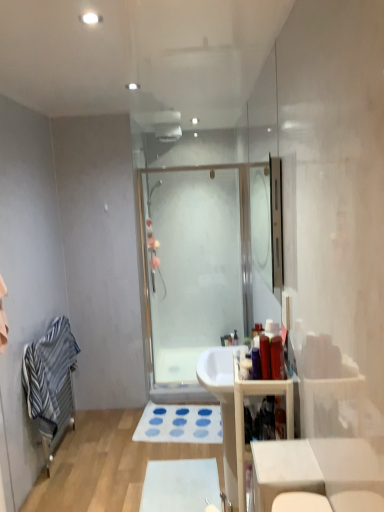
Looking at this image, in order to face wooden cabinet at right, should I rotate leftwards or rightwards?

Turn right by 8.978 degrees to look at wooden cabinet at right.

Locate an element on the screen. The width and height of the screenshot is (384, 512). matte plastic container at right, marked as the 1th toiletry in a right-to-left arrangement is located at coordinates (277, 358).

What is the approximate height of translucent plastic bottle at right, which ranks as the 1th toiletry in left-to-right order?

translucent plastic bottle at right, which ranks as the 1th toiletry in left-to-right order, is 6.79 inches tall.

Where is `blue fabric bath mat at lower center, arranged as the second bath mat when viewed from the front`? blue fabric bath mat at lower center, arranged as the second bath mat when viewed from the front is located at coordinates (180, 424).

This screenshot has width=384, height=512. Find the location of `white glossy sink at center`. white glossy sink at center is located at coordinates (223, 405).

Is wooden cabinet at right positioned with its back to matte plastic bottle at right, the 2th toiletry viewed from the right?

That's not correct — wooden cabinet at right is not looking away from matte plastic bottle at right, the 2th toiletry viewed from the right.

Considering the positions of objects wooden cabinet at right and matte plastic bottle at right, placed as the second toiletry when sorted from left to right, in the image provided, who is more to the right, wooden cabinet at right or matte plastic bottle at right, placed as the second toiletry when sorted from left to right,?

From the viewer's perspective, wooden cabinet at right appears more on the right side.

Would you say wooden cabinet at right is inside or outside matte plastic bottle at right, placed as the second toiletry when sorted from left to right?

wooden cabinet at right is located beyond the bounds of matte plastic bottle at right, placed as the second toiletry when sorted from left to right.

Looking at this image, from a real-world perspective, is wooden cabinet at right physically located above or below matte plastic bottle at right, placed as the second toiletry when sorted from left to right?

wooden cabinet at right is situated lower than matte plastic bottle at right, placed as the second toiletry when sorted from left to right, in the real world.

Is white glossy sink at center far from wooden cabinet at right?

Actually, white glossy sink at center and wooden cabinet at right are a little close together.

From a real-world perspective, which object stands above the other?

wooden cabinet at right.

How distant is white glossy sink at center from wooden cabinet at right?

white glossy sink at center and wooden cabinet at right are 14.07 centimeters apart from each other.

Where is `table in front of the blue fabric bath mat at lower center, arranged as the first bath mat when viewed from the back`? The height and width of the screenshot is (512, 384). table in front of the blue fabric bath mat at lower center, arranged as the first bath mat when viewed from the back is located at coordinates (314, 468).

How distant is blue fabric bath mat at lower center, arranged as the first bath mat when viewed from the back, from white glossy table at lower right?

blue fabric bath mat at lower center, arranged as the first bath mat when viewed from the back, is 5.97 feet from white glossy table at lower right.

Are blue fabric bath mat at lower center, the 1th bath mat when ordered from top to bottom, and white glossy table at lower right making contact?

No, blue fabric bath mat at lower center, the 1th bath mat when ordered from top to bottom, is not in contact with white glossy table at lower right.

Relative to white glossy table at lower right, is blue fabric bath mat at lower center, arranged as the first bath mat when viewed from the back, in front or behind?

Visually, blue fabric bath mat at lower center, arranged as the first bath mat when viewed from the back, is located behind white glossy table at lower right.

This screenshot has height=512, width=384. I want to click on toiletry that is the 3rd object located below the clear glass mirror at upper center (from the image's perspective), so click(256, 360).

How distant is clear glass mirror at upper center from translucent plastic bottle at right, which ranks as the 1th toiletry in left-to-right order?

The distance of clear glass mirror at upper center from translucent plastic bottle at right, which ranks as the 1th toiletry in left-to-right order, is 1.68 meters.

Which of these two, clear glass mirror at upper center or translucent plastic bottle at right, which ranks as the third toiletry in right-to-left order, is thinner?

Thinner between the two is translucent plastic bottle at right, which ranks as the third toiletry in right-to-left order.

Is clear glass mirror at upper center looking in the opposite direction of translucent plastic bottle at right, which ranks as the 1th toiletry in left-to-right order?

No.

Is matte plastic bottle at right, the 2th toiletry viewed from the right, spatially inside translucent plastic bottle at right, which ranks as the third toiletry in right-to-left order, or outside of it?

matte plastic bottle at right, the 2th toiletry viewed from the right, is spatially situated outside translucent plastic bottle at right, which ranks as the third toiletry in right-to-left order.

I want to click on toiletry lying behind the matte plastic bottle at right, the 2th toiletry viewed from the right, so click(x=256, y=360).

Is matte plastic bottle at right, placed as the second toiletry when sorted from left to right, in front of or behind translucent plastic bottle at right, which ranks as the third toiletry in right-to-left order, in the image?

Clearly, matte plastic bottle at right, placed as the second toiletry when sorted from left to right, is in front of translucent plastic bottle at right, which ranks as the third toiletry in right-to-left order.

From the picture: Between matte plastic bottle at right, the 2th toiletry viewed from the right, and translucent plastic bottle at right, which ranks as the third toiletry in right-to-left order, which one appears on the left side from the viewer's perspective?

From the viewer's perspective, translucent plastic bottle at right, which ranks as the third toiletry in right-to-left order, appears more on the left side.

From a real-world perspective, is matte plastic container at right, marked as the 1th toiletry in a right-to-left arrangement, above or below clear glass mirror at upper center?

matte plastic container at right, marked as the 1th toiletry in a right-to-left arrangement, is below clear glass mirror at upper center.

Does matte plastic container at right, marked as the 1th toiletry in a right-to-left arrangement, appear on the right side of clear glass mirror at upper center?

In fact, matte plastic container at right, marked as the 1th toiletry in a right-to-left arrangement, is to the left of clear glass mirror at upper center.

Image resolution: width=384 pixels, height=512 pixels. In order to click on the 3rd toiletry in front of the clear glass mirror at upper center in this screenshot , I will do `click(277, 358)`.

Considering the relative sizes of white glossy sink at center and striped cotton bath towel at left in the image provided, is white glossy sink at center taller than striped cotton bath towel at left?

Yes, white glossy sink at center is taller than striped cotton bath towel at left.

Identify the location of bath towel lying above the white glossy sink at center (from the image's perspective). The width and height of the screenshot is (384, 512). (49, 371).

Is striped cotton bath towel at left at the back of white glossy sink at center?

No, white glossy sink at center is not facing away from striped cotton bath towel at left.

From the image's perspective, is white glossy sink at center above or below striped cotton bath towel at left?

white glossy sink at center is situated lower than striped cotton bath towel at left in the image.

You are a GUI agent. You are given a task and a screenshot of the screen. Output one action in this format:
    pyautogui.click(x=<x>, y=<y>)
    Task: Click on the 2nd toiletry above the wooden cabinet at right (from the image's perspective)
    
    Given the screenshot: What is the action you would take?
    tap(265, 357)

Locate an element on the screen. The height and width of the screenshot is (512, 384). bathroom cabinet on the right of white glossy sink at center is located at coordinates (243, 418).

Based on the photo, based on their spatial positions, is white glossy sink at center or clear glass shower door at center further from white matte bath mat at lower center, which appears as the 2th bath mat when viewed from the top?

The object further to white matte bath mat at lower center, which appears as the 2th bath mat when viewed from the top, is clear glass shower door at center.

Looking at the image, which one is located closer to clear glass mirror at upper center, clear glass shower door at center or matte plastic bottle at right, the 2th toiletry viewed from the right?

The object closer to clear glass mirror at upper center is clear glass shower door at center.

Which object lies further to the anchor point translucent plastic bottle at right, which ranks as the 1th toiletry in left-to-right order, striped cotton bath towel at left or white glossy sink at center?

striped cotton bath towel at left lies further to translucent plastic bottle at right, which ranks as the 1th toiletry in left-to-right order, than the other object.

Based on their spatial positions, is striped cotton bath towel at left or white glossy faucet at lower center further from white glossy sink at center?

Among the two, striped cotton bath towel at left is located further to white glossy sink at center.

Based on their spatial positions, is striped cotton bath towel at left or matte plastic bottle at right, the 2th toiletry viewed from the right, closer to clear glass shower door at center?

Among the two, striped cotton bath towel at left is located nearer to clear glass shower door at center.

Which object lies nearer to the anchor point white matte bath mat at lower center, the first bath mat when ordered from bottom to top, white glossy faucet at lower center or wooden cabinet at right?

white glossy faucet at lower center.

Considering their positions, is blue fabric bath mat at lower center, the 1th bath mat when ordered from top to bottom, positioned further to white matte bath mat at lower center, the 1th bath mat when ordered from front to back, than clear glass shower door at center?

clear glass shower door at center.

Considering their positions, is white matte bath mat at lower center, the first bath mat when ordered from bottom to top, positioned further to blue fabric bath mat at lower center, arranged as the second bath mat when viewed from the front, than clear glass shower door at center?

clear glass shower door at center lies further to blue fabric bath mat at lower center, arranged as the second bath mat when viewed from the front, than the other object.

Find the location of a particular element. This screenshot has width=384, height=512. bath towel positioned between white glossy faucet at lower center and clear glass shower door at center from near to far is located at coordinates tap(49, 371).

Find the location of a particular element. Image resolution: width=384 pixels, height=512 pixels. toiletry between matte plastic bottle at right, placed as the second toiletry when sorted from left to right, and white glossy faucet at lower center vertically is located at coordinates (256, 360).

Identify the location of sink between matte plastic container at right, placed as the third toiletry when sorted from left to right, and clear glass shower door at center, along the z-axis. Image resolution: width=384 pixels, height=512 pixels. (223, 405).

Where is `toiletry located between matte plastic bottle at right, the 2th toiletry viewed from the right, and blue fabric bath mat at lower center, arranged as the first bath mat when viewed from the back, in the depth direction`? Image resolution: width=384 pixels, height=512 pixels. toiletry located between matte plastic bottle at right, the 2th toiletry viewed from the right, and blue fabric bath mat at lower center, arranged as the first bath mat when viewed from the back, in the depth direction is located at coordinates (256, 360).